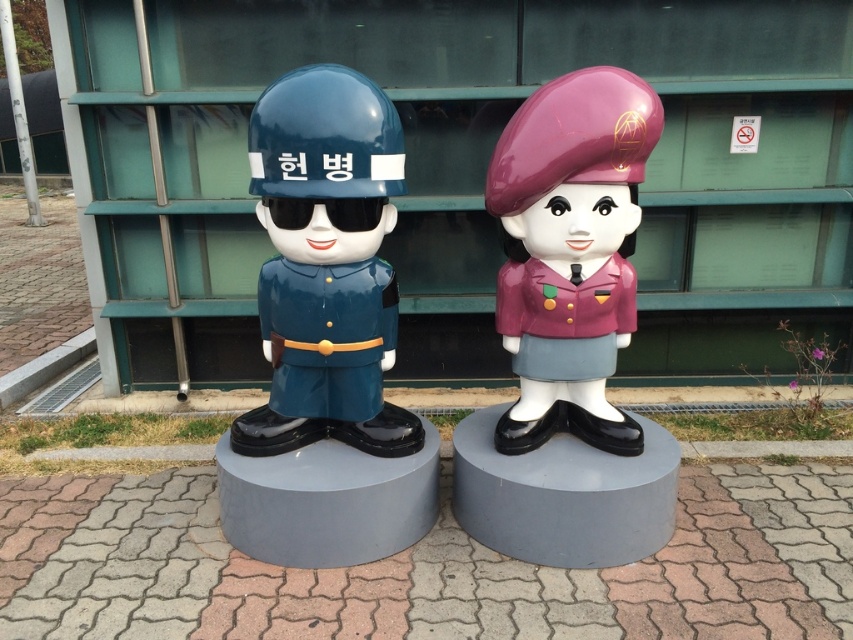
Who is taller, glossy blue helmet at center or purple glossy beret at center?

Standing taller between the two is glossy blue helmet at center.

Between glossy blue helmet at center and purple glossy beret at center, which one is positioned higher?

purple glossy beret at center is above.

Describe the element at coordinates (326, 337) in the screenshot. Image resolution: width=853 pixels, height=640 pixels. I see `glossy blue helmet at center` at that location.

The height and width of the screenshot is (640, 853). I want to click on glossy blue helmet at center, so click(x=326, y=337).